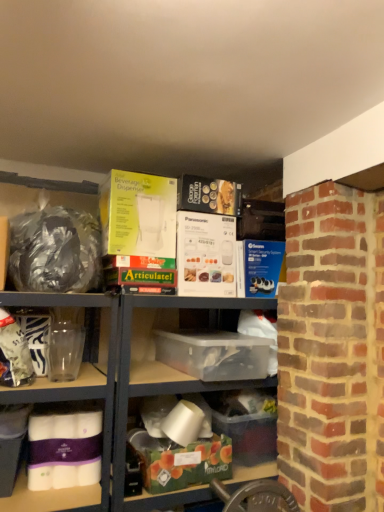
Measure the distance between point (151, 221) and camera.

6.27 feet.

You are a GUI agent. You are given a task and a screenshot of the screen. Output one action in this format:
    pyautogui.click(x=<x>, y=<y>)
    Task: Click on the purple matte tissue at lower left, the third box from the top
    This screenshot has width=384, height=512.
    Given the screenshot: What is the action you would take?
    pyautogui.click(x=65, y=446)

Measure the distance between point (157, 480) and camera.

Point (157, 480) is 5.75 feet away from camera.

This screenshot has width=384, height=512. What do you see at coordinates (246, 424) in the screenshot?
I see `translucent plastic container at center, the 1th box ordered from the bottom` at bounding box center [246, 424].

The image size is (384, 512). In order to click on clear plastic container at center in this screenshot , I will do `click(153, 365)`.

Considering their positions, is clear plastic container at center located in front of or behind shiny metallic bag at left?

Clearly, clear plastic container at center is behind shiny metallic bag at left.

At what (x,y) coordinates should I click in order to perform the action: click on waste that appears in front of the clear plastic container at center. Please return your answer as a coordinate pair (x, y). Looking at the image, I should click on pos(55,251).

Is clear plastic container at center positioned far away from shiny metallic bag at left?

No, there isn't a large distance between clear plastic container at center and shiny metallic bag at left.

From a real-world perspective, is transparent plastic box at center, the fourth box from the bottom, under purple matte tissue at lower left, the 3th box positioned from the bottom?

No, from a real-world perspective, transparent plastic box at center, the fourth box from the bottom, is not beneath purple matte tissue at lower left, the 3th box positioned from the bottom.

Considering the relative positions of transparent plastic box at center, marked as the 2th box in a top-to-bottom arrangement, and purple matte tissue at lower left, the 3th box positioned from the bottom, in the image provided, is transparent plastic box at center, marked as the 2th box in a top-to-bottom arrangement, to the right of purple matte tissue at lower left, the 3th box positioned from the bottom, from the viewer's perspective?

Yes, transparent plastic box at center, marked as the 2th box in a top-to-bottom arrangement, is to the right of purple matte tissue at lower left, the 3th box positioned from the bottom.

Is transparent plastic box at center, the fourth box from the bottom, positioned before purple matte tissue at lower left, the 3th box positioned from the bottom?

No, it is not.

Is shiny metallic bag at left with translucent plastic container at center, the 1th box ordered from the bottom?

No, shiny metallic bag at left is not next to translucent plastic container at center, the 1th box ordered from the bottom.

Considering the sizes of objects shiny metallic bag at left and translucent plastic container at center, arranged as the fifth box when viewed from the top, in the image provided, who is smaller, shiny metallic bag at left or translucent plastic container at center, arranged as the fifth box when viewed from the top,?

Smaller between the two is translucent plastic container at center, arranged as the fifth box when viewed from the top.

From the picture: Is translucent plastic container at center, the 1th box ordered from the bottom, inside shiny metallic bag at left?

That's incorrect, translucent plastic container at center, the 1th box ordered from the bottom, is not inside shiny metallic bag at left.

From a real-world perspective, does shiny metallic bag at left sit lower than translucent plastic container at center, the 1th box ordered from the bottom?

No, from a real-world perspective, shiny metallic bag at left is not beneath translucent plastic container at center, the 1th box ordered from the bottom.

Looking at this image, is transparent plastic box at center, marked as the 2th box in a top-to-bottom arrangement, oriented away from green matte box at lower center, the fourth box positioned from the top?

No, transparent plastic box at center, marked as the 2th box in a top-to-bottom arrangement, is not facing the opposite direction of green matte box at lower center, the fourth box positioned from the top.

From the image's perspective, who appears lower, transparent plastic box at center, the fourth box from the bottom, or green matte box at lower center, the fourth box positioned from the top?

green matte box at lower center, the fourth box positioned from the top, appears lower in the image.

Is transparent plastic box at center, marked as the 2th box in a top-to-bottom arrangement, inside the boundaries of green matte box at lower center, which is the second box in bottom-to-top order, or outside?

transparent plastic box at center, marked as the 2th box in a top-to-bottom arrangement, is located beyond the bounds of green matte box at lower center, which is the second box in bottom-to-top order.

Between point (197, 340) and point (153, 485), which one is positioned in front?

The point (153, 485) is closer to the camera.

Considering the sizes of objects transparent plastic box at center, the fourth box from the bottom, and translucent plastic container at center, arranged as the fifth box when viewed from the top, in the image provided, who is bigger, transparent plastic box at center, the fourth box from the bottom, or translucent plastic container at center, arranged as the fifth box when viewed from the top,?

transparent plastic box at center, the fourth box from the bottom.

Does transparent plastic box at center, marked as the 2th box in a top-to-bottom arrangement, come behind translucent plastic container at center, arranged as the fifth box when viewed from the top?

No, it is not.

Is transparent plastic box at center, marked as the 2th box in a top-to-bottom arrangement, aimed at translucent plastic container at center, arranged as the fifth box when viewed from the top?

No, transparent plastic box at center, marked as the 2th box in a top-to-bottom arrangement, is not aimed at translucent plastic container at center, arranged as the fifth box when viewed from the top.

Is clear plastic container at center inside the boundaries of green matte box at lower center, the fourth box positioned from the top, or outside?

clear plastic container at center is located beyond the bounds of green matte box at lower center, the fourth box positioned from the top.

From the picture: Are clear plastic container at center and green matte box at lower center, the fourth box positioned from the top, located far from each other?

No, clear plastic container at center is in close proximity to green matte box at lower center, the fourth box positioned from the top.

How much distance is there between clear plastic container at center and green matte box at lower center, which is the second box in bottom-to-top order?

A distance of 12.29 inches exists between clear plastic container at center and green matte box at lower center, which is the second box in bottom-to-top order.

From a real-world perspective, is green matte box at lower center, the fourth box positioned from the top, above or below purple matte tissue at lower left, the third box from the top?

From a real-world perspective, green matte box at lower center, the fourth box positioned from the top, is physically below purple matte tissue at lower left, the third box from the top.

Is green matte box at lower center, the fourth box positioned from the top, completely or partially outside of purple matte tissue at lower left, the 3th box positioned from the bottom?

Yes.

Considering the relative sizes of green matte box at lower center, which is the second box in bottom-to-top order, and purple matte tissue at lower left, the third box from the top, in the image provided, is green matte box at lower center, which is the second box in bottom-to-top order, wider than purple matte tissue at lower left, the third box from the top,?

Indeed, green matte box at lower center, which is the second box in bottom-to-top order, has a greater width compared to purple matte tissue at lower left, the third box from the top.

Where is `waste above the clear plastic container at center (from a real-world perspective)`? waste above the clear plastic container at center (from a real-world perspective) is located at coordinates (55, 251).

Locate an element on the screen. This screenshot has width=384, height=512. the 1st box below the transparent plastic box at center, marked as the 2th box in a top-to-bottom arrangement (from the image's perspective) is located at coordinates (65, 446).

Based on their spatial positions, is shiny metallic bag at left or clear plastic container at center further from transparent plastic box at center, marked as the 2th box in a top-to-bottom arrangement?

Among the two, shiny metallic bag at left is located further to transparent plastic box at center, marked as the 2th box in a top-to-bottom arrangement.

Looking at this image, which object lies further to the anchor point clear plastic container at center, purple matte tissue at lower left, the third box from the top, or green matte box at lower center, the fourth box positioned from the top?

green matte box at lower center, the fourth box positioned from the top, is positioned further to the anchor clear plastic container at center.

Which object lies further to the anchor point clear plastic container at center, translucent plastic container at center, arranged as the fifth box when viewed from the top, or shiny metallic bag at left?

shiny metallic bag at left lies further to clear plastic container at center than the other object.

Estimate the real-world distances between objects in this image. Which object is closer to purple matte tissue at lower left, the third box from the top, translucent plastic container at center, the 1th box ordered from the bottom, or clear plastic container at center?

Among the two, clear plastic container at center is located nearer to purple matte tissue at lower left, the third box from the top.

Based on their spatial positions, is purple matte tissue at lower left, the third box from the top, or shiny metallic bag at left further from yellow cardboard beverage dispenser at upper center, which ranks as the first box in top-to-bottom order?

purple matte tissue at lower left, the third box from the top, lies further to yellow cardboard beverage dispenser at upper center, which ranks as the first box in top-to-bottom order, than the other object.

Based on their spatial positions, is clear plastic container at center or purple matte tissue at lower left, the 3th box positioned from the bottom, closer to green matte box at lower center, which is the second box in bottom-to-top order?

clear plastic container at center is closer to green matte box at lower center, which is the second box in bottom-to-top order.

When comparing their distances from green matte box at lower center, the fourth box positioned from the top, does shiny metallic bag at left or clear plastic container at center seem further?

The object further to green matte box at lower center, the fourth box positioned from the top, is shiny metallic bag at left.

Looking at the image, which one is located further to purple matte tissue at lower left, the third box from the top, shiny metallic bag at left or yellow cardboard beverage dispenser at upper center, which ranks as the first box in top-to-bottom order?

yellow cardboard beverage dispenser at upper center, which ranks as the first box in top-to-bottom order.

Identify the location of waste between yellow cardboard beverage dispenser at upper center, which ranks as the first box in top-to-bottom order, and transparent plastic box at center, the fourth box from the bottom, in the vertical direction. Image resolution: width=384 pixels, height=512 pixels. (55, 251).

Locate an element on the screen. This screenshot has width=384, height=512. waste between yellow cardboard beverage dispenser at upper center, which ranks as the first box in top-to-bottom order, and green matte box at lower center, the fourth box positioned from the top, vertically is located at coordinates (55, 251).

Identify the location of waste between yellow cardboard beverage dispenser at upper center, the 5th box ordered from the bottom, and translucent plastic container at center, arranged as the fifth box when viewed from the top, from top to bottom. (55, 251).

This screenshot has height=512, width=384. What are the coordinates of `shelf that lies between transparent plastic box at center, marked as the 2th box in a top-to-bottom arrangement, and green matte box at lower center, which is the second box in bottom-to-top order, from top to bottom` in the screenshot? It's located at (153, 365).